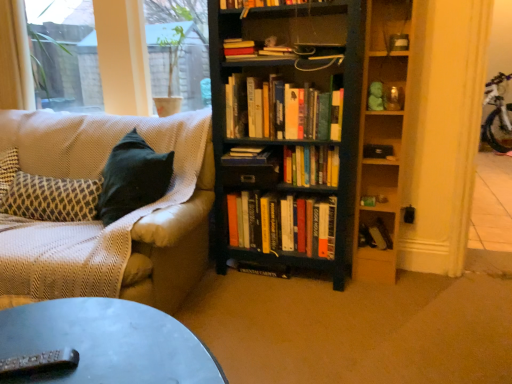
Where is `free space in front of dark wood bookcase at center`? The image size is (512, 384). free space in front of dark wood bookcase at center is located at coordinates (303, 319).